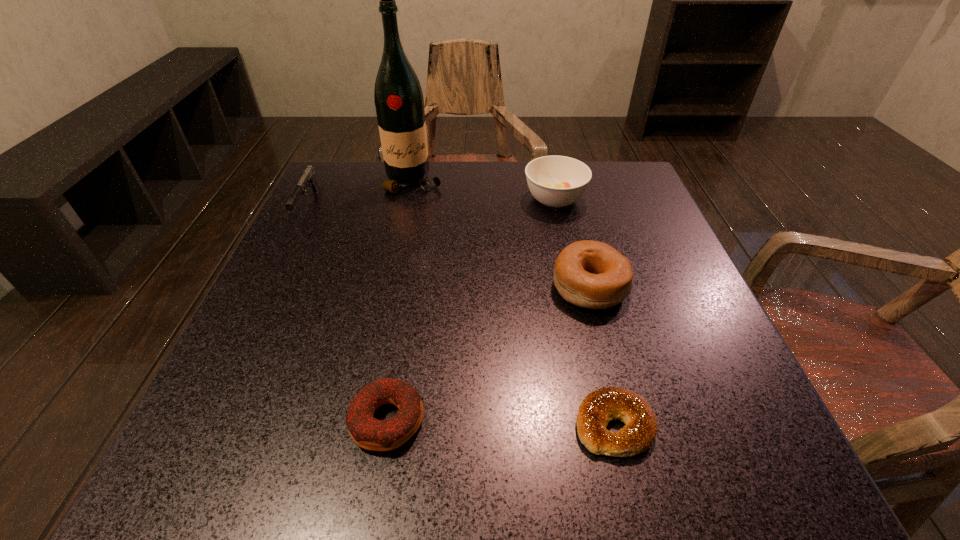
I want to click on vacant space that is in between the soup bowl and the wine bottle, so [485, 190].

What are the coordinates of `free space between the wine bottle and the soup bowl` in the screenshot? It's located at (485, 190).

This screenshot has height=540, width=960. In order to click on vacant space that's between the doughnut and the soup bowl in this screenshot , I will do point(471,309).

Identify the location of free space between the doughnut and the taller bagel. The image size is (960, 540). (489, 354).

This screenshot has width=960, height=540. In order to click on vacant area between the gun and the tallest object in this screenshot , I will do `click(361, 194)`.

Image resolution: width=960 pixels, height=540 pixels. Find the location of `free point between the wine bottle and the leftmost object`. free point between the wine bottle and the leftmost object is located at coordinates (361, 194).

What are the coordinates of `vacant region between the doughnut and the tallest object` in the screenshot? It's located at (401, 301).

Image resolution: width=960 pixels, height=540 pixels. I want to click on vacant point located between the taller bagel and the second shortest object, so click(489, 354).

Find the location of `vacant point located between the fifth tallest object and the soup bowl`. vacant point located between the fifth tallest object and the soup bowl is located at coordinates (471, 309).

Identify the location of free space between the fifth tallest object and the soup bowl. (471, 309).